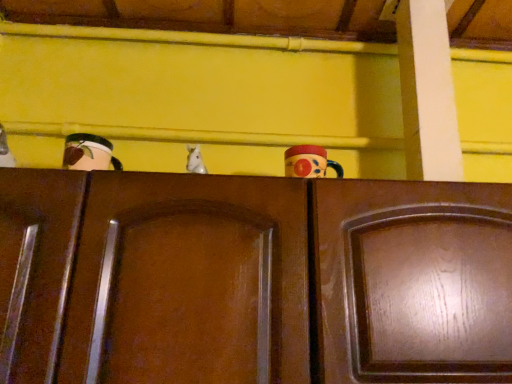
Question: Does glossy wood door at center, the first door when ordered from left to right, have a larger size compared to white glossy horse at center, the second toy in the right-to-left sequence?

Choices:
 (A) no
 (B) yes

Answer: (B)

Question: From the image's perspective, would you say glossy wood door at center, which is the 2th door from right to left, is positioned over white glossy horse at center, placed as the 1th toy when sorted from left to right?

Choices:
 (A) no
 (B) yes

Answer: (A)

Question: From a real-world perspective, is glossy wood door at center, the first door when ordered from left to right, beneath white glossy horse at center, placed as the 1th toy when sorted from left to right?

Choices:
 (A) no
 (B) yes

Answer: (B)

Question: Is glossy wood door at center, which is the 2th door from right to left, in contact with white glossy horse at center, the second toy in the right-to-left sequence?

Choices:
 (A) yes
 (B) no

Answer: (B)

Question: Considering the relative positions of glossy wood door at center, which is the 2th door from right to left, and white glossy horse at center, the second toy in the right-to-left sequence, in the image provided, is glossy wood door at center, which is the 2th door from right to left, to the left of white glossy horse at center, the second toy in the right-to-left sequence, from the viewer's perspective?

Choices:
 (A) yes
 (B) no

Answer: (A)

Question: From the image's perspective, is white glossy horse at center, placed as the 1th toy when sorted from left to right, positioned above or below wooden cabinet at center, the 2th door from the left?

Choices:
 (A) below
 (B) above

Answer: (B)

Question: Does point (198, 153) appear closer or farther from the camera than point (348, 379)?

Choices:
 (A) closer
 (B) farther

Answer: (B)

Question: Looking at their shapes, would you say white glossy horse at center, the second toy in the right-to-left sequence, is wider or thinner than wooden cabinet at center, placed as the first door when sorted from right to left?

Choices:
 (A) wide
 (B) thin

Answer: (B)

Question: In terms of size, does white glossy horse at center, the second toy in the right-to-left sequence, appear bigger or smaller than wooden cabinet at center, placed as the first door when sorted from right to left?

Choices:
 (A) big
 (B) small

Answer: (B)

Question: Is point (189, 157) positioned closer to the camera than point (211, 321)?

Choices:
 (A) closer
 (B) farther

Answer: (B)

Question: In terms of size, does white glossy horse at center, placed as the 1th toy when sorted from left to right, appear bigger or smaller than glossy wood door at center, the first door when ordered from left to right?

Choices:
 (A) small
 (B) big

Answer: (A)

Question: Relative to glossy wood door at center, which is the 2th door from right to left, is white glossy horse at center, the second toy in the right-to-left sequence, in front or behind?

Choices:
 (A) front
 (B) behind

Answer: (B)

Question: Based on their positions, is white glossy horse at center, placed as the 1th toy when sorted from left to right, located to the left or right of glossy wood door at center, which is the 2th door from right to left?

Choices:
 (A) left
 (B) right

Answer: (B)

Question: Relative to glossy ceramic mug at upper center, which ranks as the second toy in left-to-right order, is white glossy horse at center, placed as the 1th toy when sorted from left to right, in front or behind?

Choices:
 (A) front
 (B) behind

Answer: (A)

Question: From a real-world perspective, is white glossy horse at center, placed as the 1th toy when sorted from left to right, physically located above or below glossy ceramic mug at upper center, the first toy when ordered from right to left?

Choices:
 (A) above
 (B) below

Answer: (A)